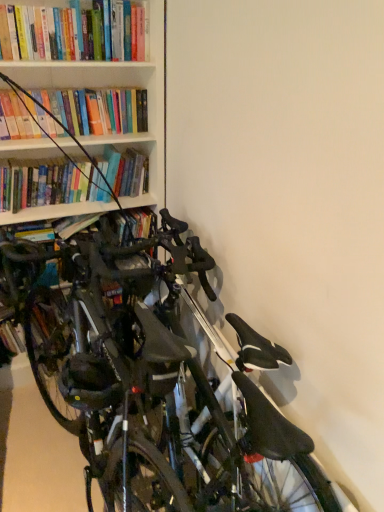
The image size is (384, 512). What are the coordinates of `matte black bicycle at center` in the screenshot? It's located at tap(154, 378).

Image resolution: width=384 pixels, height=512 pixels. Describe the element at coordinates (154, 378) in the screenshot. I see `matte black bicycle at center` at that location.

At what (x,y) coordinates should I click in order to perform the action: click on matte black bicycle at center. Please return your answer as a coordinate pair (x, y). This screenshot has height=512, width=384. Looking at the image, I should click on (154, 378).